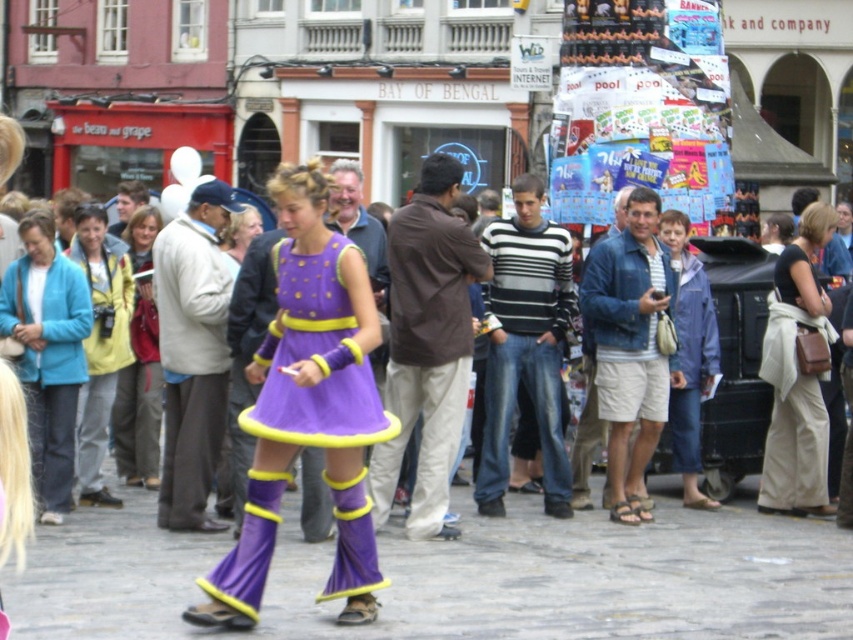
Question: Estimate the real-world distances between objects in this image. Which object is closer to the beige cotton pants at lower right?

Choices:
 (A) yellow-green fabric jacket at left
 (B) striped sweater at center
 (C) brown fabric shirt at center
 (D) teal fabric jacket at left

Answer: (B)

Question: Which point is farther to the camera?

Choices:
 (A) (119, 236)
 (B) (65, 262)
 (C) (173, 260)

Answer: (A)

Question: Does striped sweater at center appear over yellow-green fabric jacket at left?

Choices:
 (A) yes
 (B) no

Answer: (A)

Question: Considering the relative positions of yellow-green fabric jacket at left and light brown leather jacket at center in the image provided, where is yellow-green fabric jacket at left located with respect to light brown leather jacket at center?

Choices:
 (A) above
 (B) below

Answer: (B)

Question: Does purple satin dress at center have a larger size compared to light brown leather jacket at center?

Choices:
 (A) no
 (B) yes

Answer: (A)

Question: Among these objects, which one is nearest to the camera?

Choices:
 (A) striped sweater at center
 (B) beige cotton pants at lower right

Answer: (B)